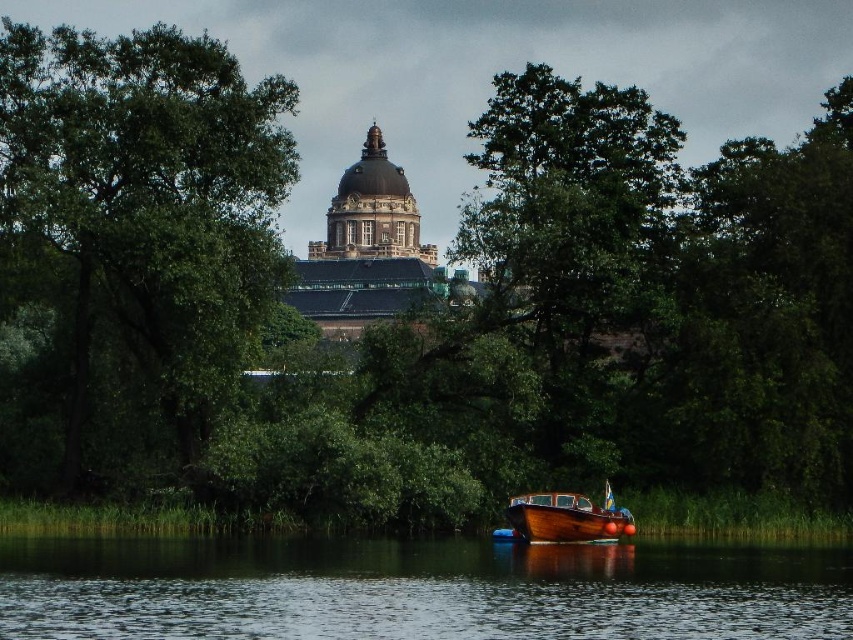
Question: Is green leafy tree at left below wooden boat at lower center?

Choices:
 (A) yes
 (B) no

Answer: (B)

Question: Which point is closer to the camera?

Choices:
 (A) (608, 541)
 (B) (454, 550)

Answer: (B)

Question: Is green leafy tree at left positioned at the back of transparent water at lower center?

Choices:
 (A) no
 (B) yes

Answer: (B)

Question: Can you confirm if green leafy tree at left is smaller than transparent water at lower center?

Choices:
 (A) no
 (B) yes

Answer: (A)

Question: Estimate the real-world distances between objects in this image. Which object is closer to the transparent water at lower center?

Choices:
 (A) green leafy tree at left
 (B) wooden boat at lower center

Answer: (B)

Question: Which point is farther from the camera taking this photo?

Choices:
 (A) (624, 528)
 (B) (421, 589)
 (C) (54, 177)

Answer: (C)